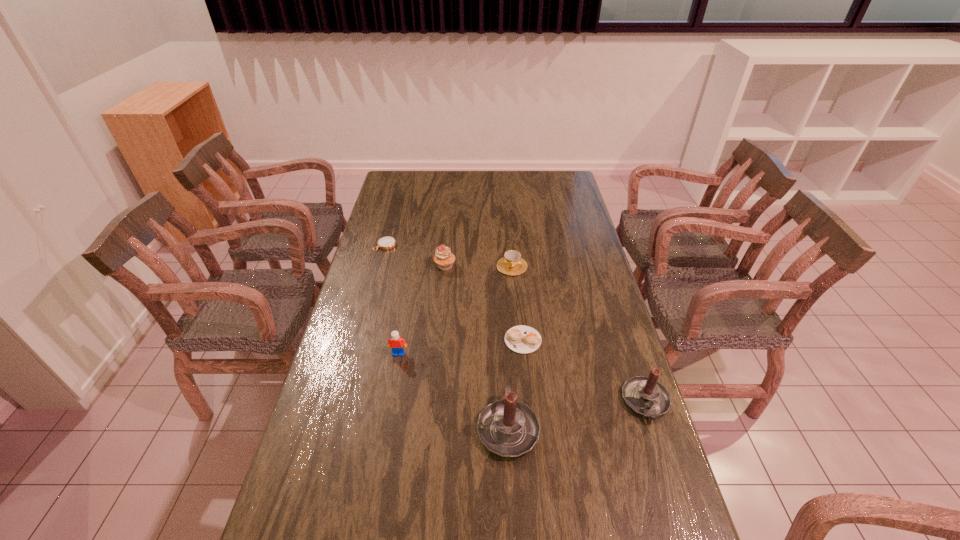
The height and width of the screenshot is (540, 960). What are the coordinates of `empty location between the sixth object from right to left and the compass` in the screenshot? It's located at (392, 299).

Find the location of a particular element. The width and height of the screenshot is (960, 540). vacant area that lies between the shorter candle and the cupcake is located at coordinates (545, 334).

Identify the location of vacant space in between the left candle and the fifth object from right to left. (476, 347).

You are a GUI agent. You are given a task and a screenshot of the screen. Output one action in this format:
    pyautogui.click(x=<x>, y=<y>)
    Task: Click on the vacant space that is in between the third object from left to right and the leftmost object
    This screenshot has height=540, width=960.
    Given the screenshot: What is the action you would take?
    pyautogui.click(x=415, y=255)

Image resolution: width=960 pixels, height=540 pixels. Identify the location of object that is the fourth nearest to the tallest object. (511, 264).

I want to click on object that is the fourth closest one to the compass, so click(x=523, y=339).

At what (x,y) coordinates should I click in order to perform the action: click on free space that satisfies the following two spatial constraints: 1. with the handle on the side of the third shortest object; 2. on the left side of the cappuccino. Please return your answer as a coordinate pair (x, y). The width and height of the screenshot is (960, 540). Looking at the image, I should click on (518, 340).